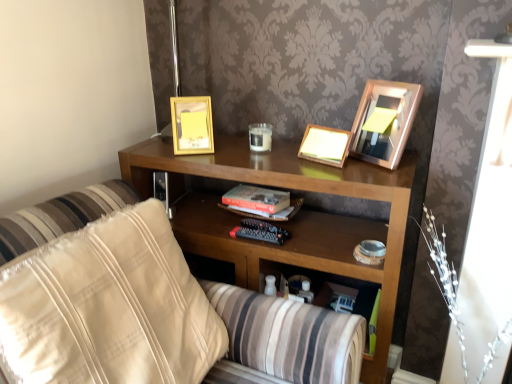
You are a GUI agent. You are given a task and a screenshot of the screen. Output one action in this format:
    pyautogui.click(x=<x>, y=<y>)
    Task: Click on the free location in front of gold metallic picture frame at upper right, arranged as the 3th picture frame when viewed from the left
    Image resolution: width=512 pixels, height=384 pixels.
    Given the screenshot: What is the action you would take?
    pyautogui.click(x=376, y=178)